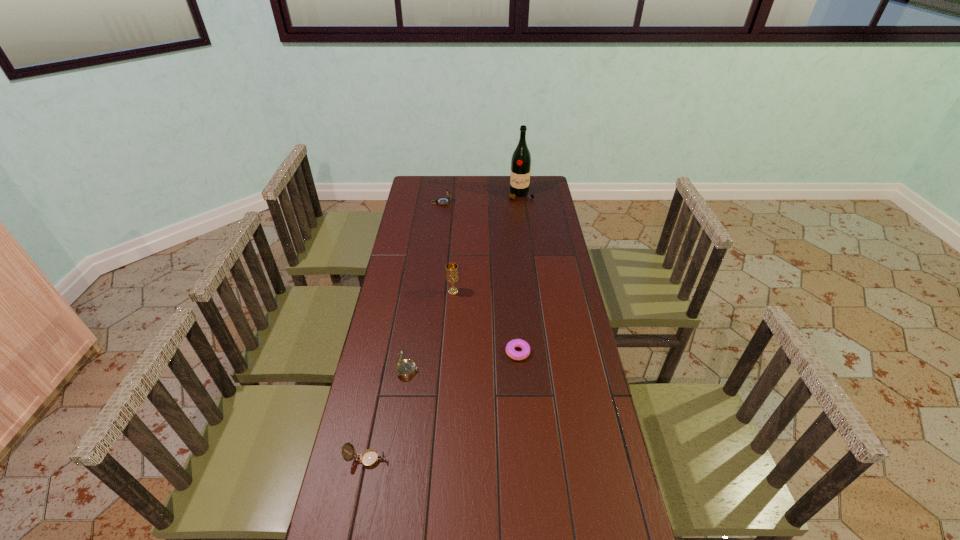
This screenshot has height=540, width=960. Find the location of `vacant space positioned on the face of the farthest compass`. vacant space positioned on the face of the farthest compass is located at coordinates (485, 202).

You are a GUI agent. You are given a task and a screenshot of the screen. Output one action in this format:
    pyautogui.click(x=<x>, y=<y>)
    Task: Click on the vacant space located with the dial facing the second farthest compass
    
    Given the screenshot: What is the action you would take?
    pyautogui.click(x=496, y=370)

This screenshot has width=960, height=540. In order to click on vacant space located on the face of the nearest object in this screenshot , I will do `click(512, 460)`.

This screenshot has width=960, height=540. In order to click on vacant space located 0.060m on the right of the doughnut in this screenshot , I will do coord(548,352).

Where is `object at the far edge`? The image size is (960, 540). object at the far edge is located at coordinates (521, 159).

The width and height of the screenshot is (960, 540). Find the location of `object that is positioned at the right edge`. object that is positioned at the right edge is located at coordinates (521, 159).

At what (x,y) coordinates should I click in order to perform the action: click on object located in the far right corner section of the desktop. Please return your answer as a coordinate pair (x, y). This screenshot has height=540, width=960. Looking at the image, I should click on (521, 159).

Where is `vacant point at the far edge`? The image size is (960, 540). vacant point at the far edge is located at coordinates coord(507,184).

In the image, there is a desktop. Where is `vacant space at the left edge`? vacant space at the left edge is located at coordinates (384, 471).

The width and height of the screenshot is (960, 540). In order to click on free region at the right edge of the desktop in this screenshot , I will do `click(594, 449)`.